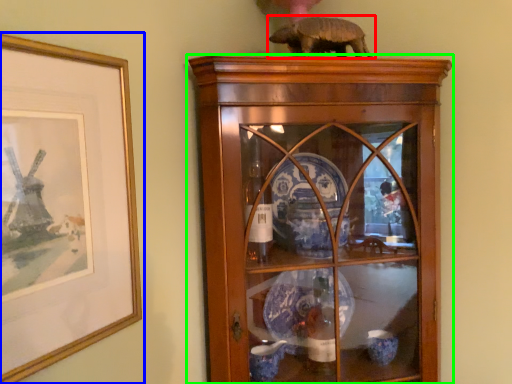
Question: Which object is the farthest from animal (highlighted by a red box)? Choose among these: picture frame (highlighted by a blue box) or shelf (highlighted by a green box).

Choices:
 (A) picture frame
 (B) shelf

Answer: (A)